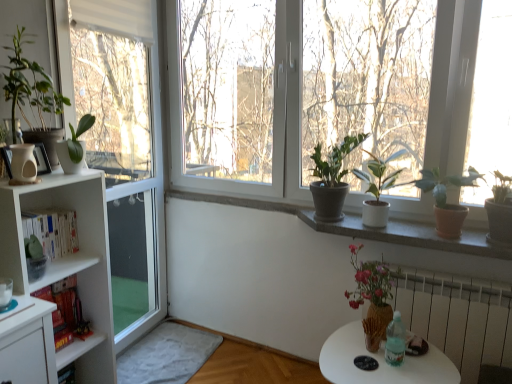
The image size is (512, 384). I want to click on free point to the right of white soft carpet at lower left, so click(x=240, y=367).